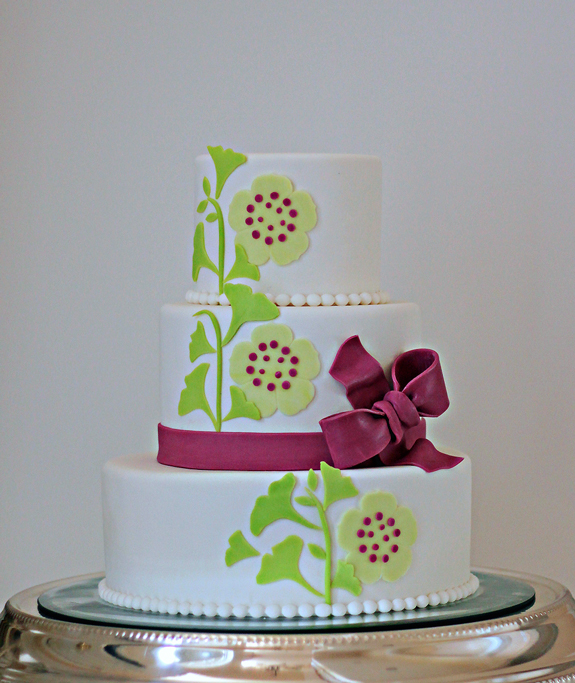
You are a GUI agent. You are given a task and a screenshot of the screen. Output one action in this format:
    pyautogui.click(x=<x>, y=<y>)
    Task: Click on the silver serving dish
    
    Given the screenshot: What is the action you would take?
    pyautogui.click(x=143, y=624)